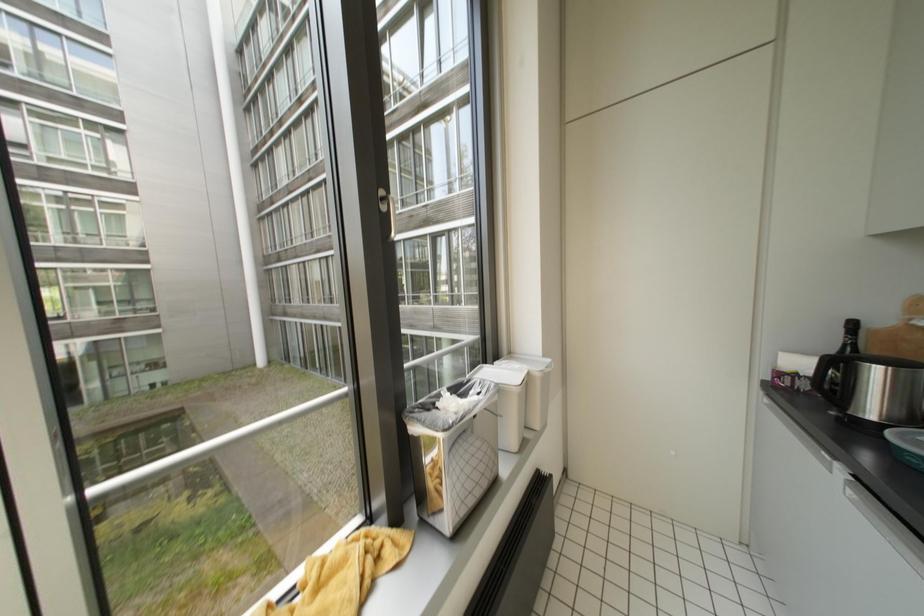
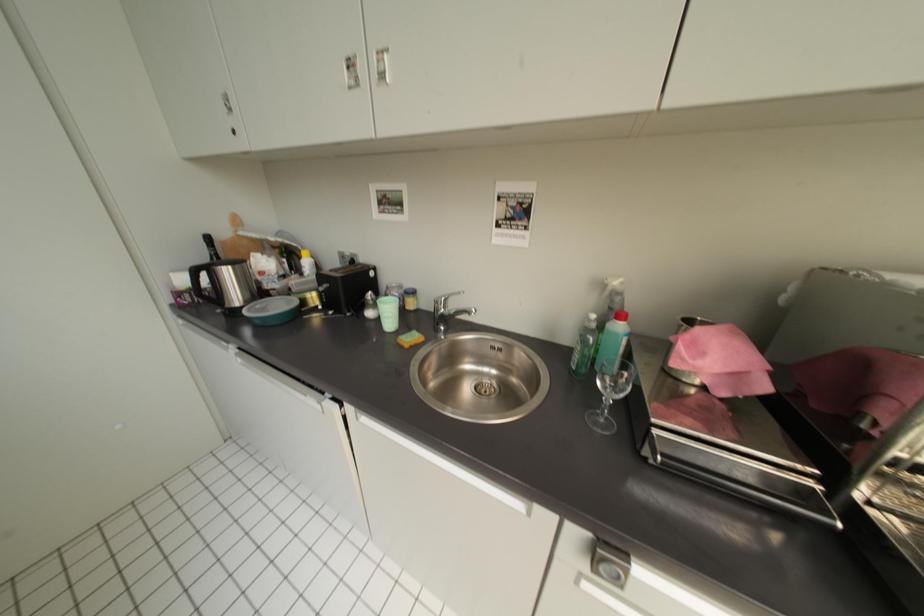
First-person continuous shooting, in which direction is the camera rotating?

The rotation direction of the camera is right-down.